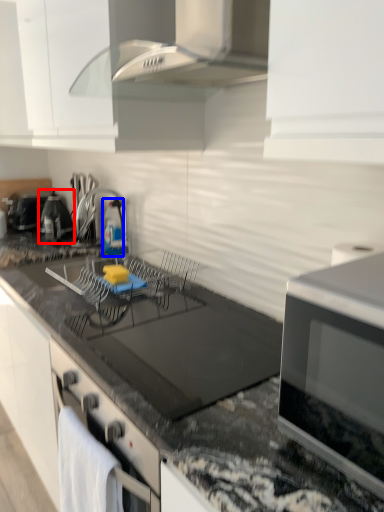
Question: Which of the following is the farthest to the observer, appliance (highlighted by a red box) or bottle (highlighted by a blue box)?

Choices:
 (A) appliance
 (B) bottle

Answer: (A)